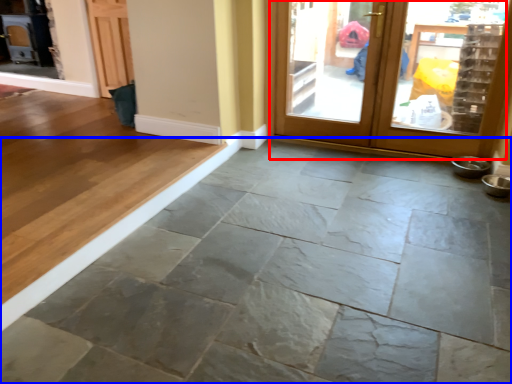
Question: Which object appears closest to the camera in this image, door (highlighted by a red box) or concrete (highlighted by a blue box)?

Choices:
 (A) door
 (B) concrete

Answer: (B)